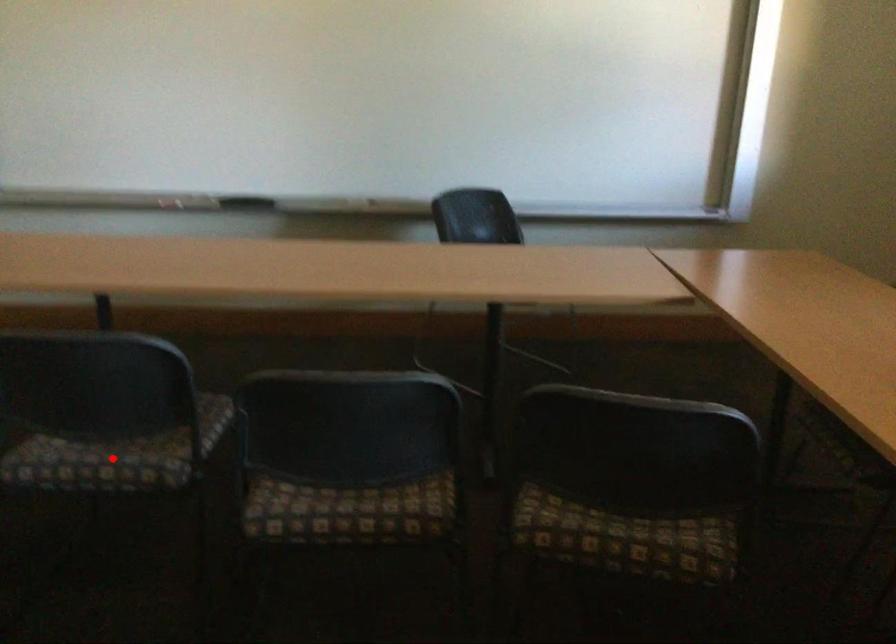
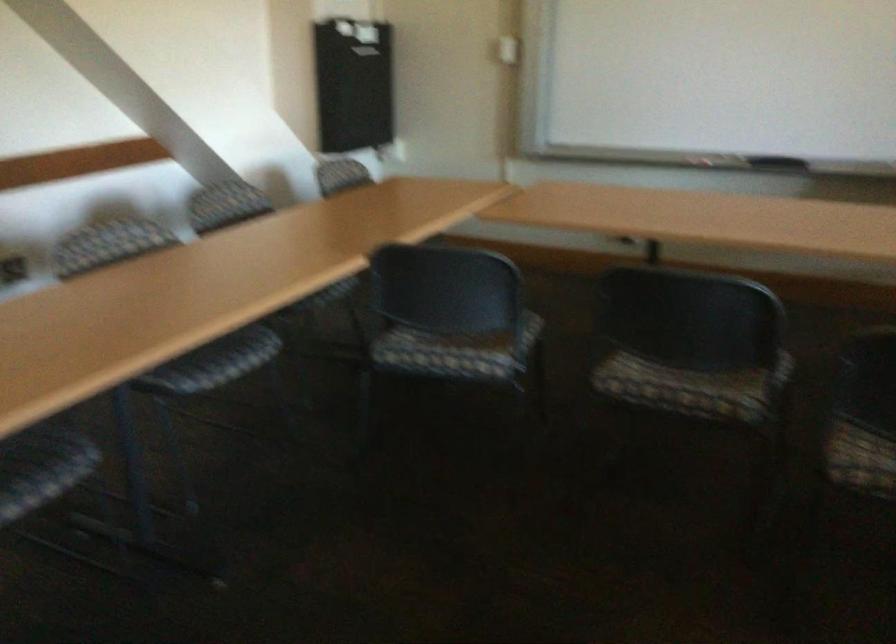
The point at the highlighted location is marked in the first image. Where is the corresponding point in the second image?

(691, 384)